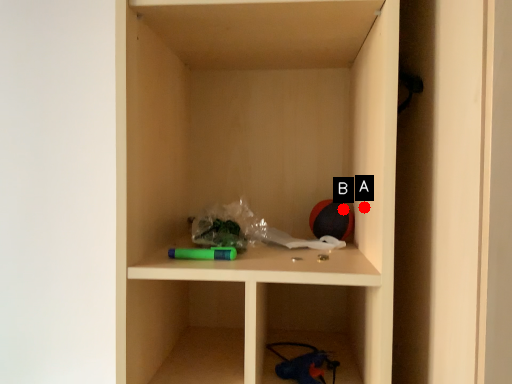
Question: Two points are circled on the image, labeled by A and B beside each circle. Which point is further to the camera?

Choices:
 (A) A is further
 (B) B is further

Answer: (B)